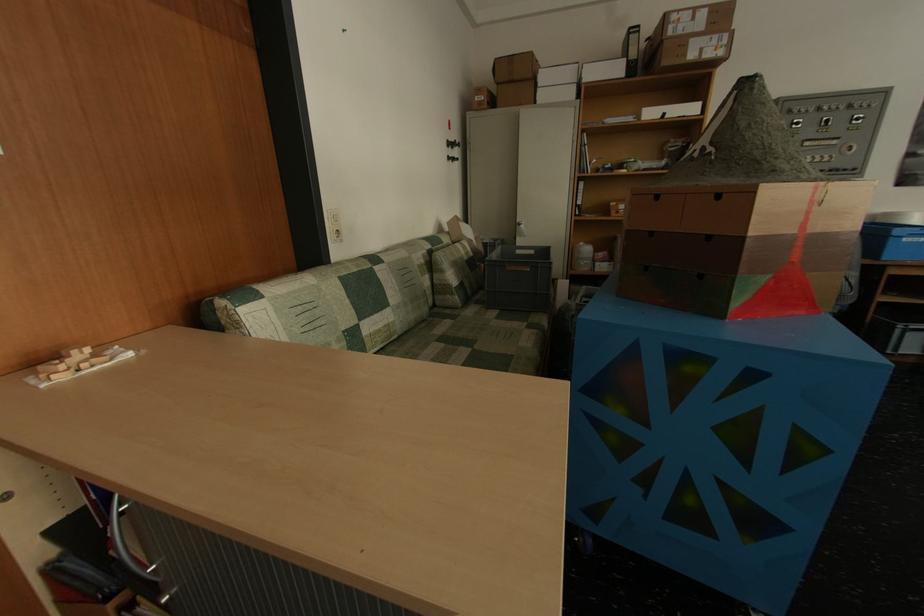
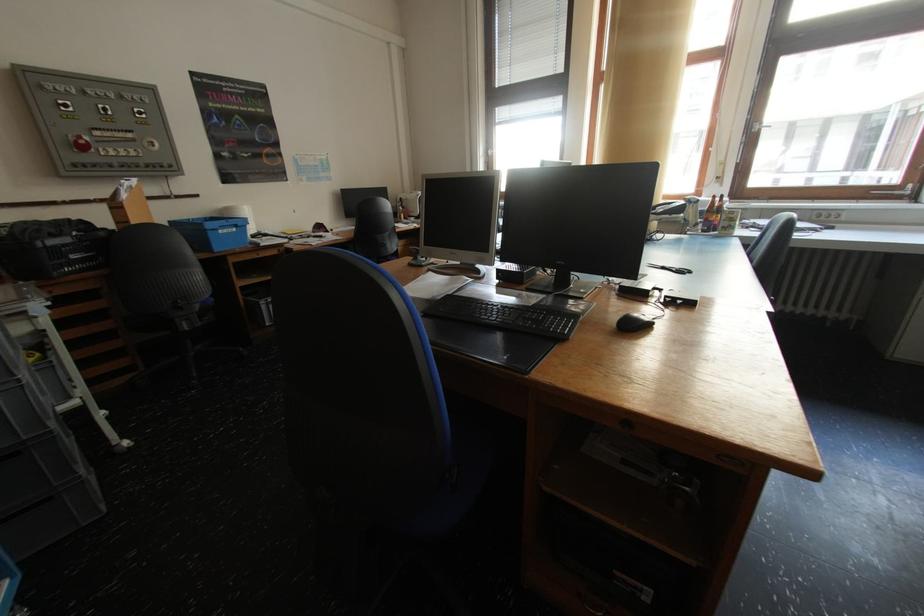
Where in the second image is the point corresponding to [803,128] from the first image?

(71, 110)